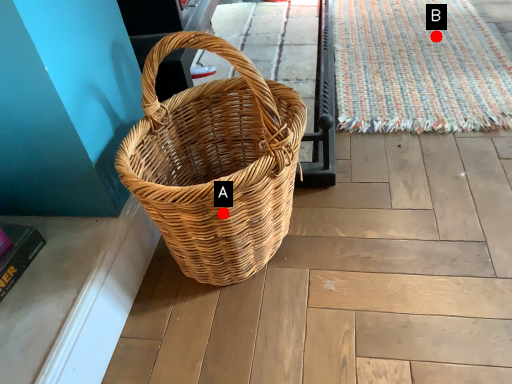
Question: Two points are circled on the image, labeled by A and B beside each circle. Which point appears closest to the camera in this image?

Choices:
 (A) A is closer
 (B) B is closer

Answer: (A)